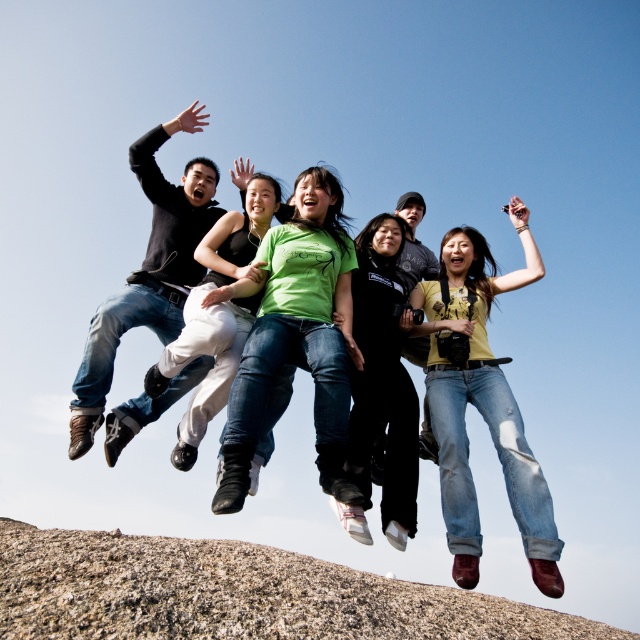
You are a photographer trying to capture the group jumping off the rock. You notice the green matte shirt at center and denim jeans at center in your frame. Which clothing item appears bigger in the photo?

The green matte shirt at center appears bigger in the photo because it has a larger size compared to the denim jeans at center.

You are planning to place a small picnic basket on the granite rock at lower center. However, you also have a pair of black matte pants at center that you need to keep dry. Which object should you place the picnic basket on to ensure the pants stay dry?

The granite rock at lower center is wider than the black matte pants at center, so placing the picnic basket on the granite rock at lower center would leave the black matte pants at center dry.

You are standing on the granite rock at lower center and want to jump into the clear blue sky. How far will you have to jump to reach the nearest person?

The granite rock at lower center and viewer are 8.00 meters apart from each other, so you would need to jump 8.00 meters to reach the nearest person.